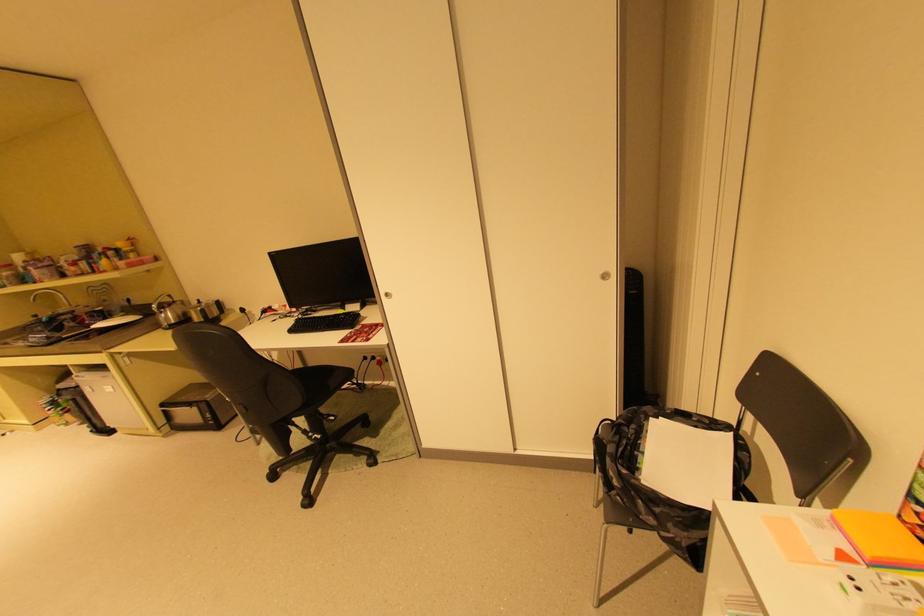
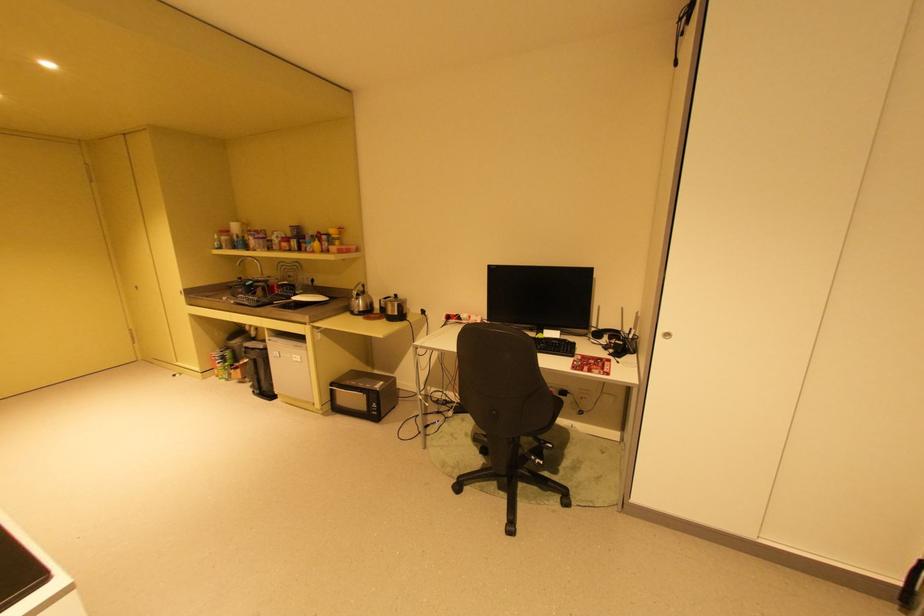
Locate, in the second image, the point that corresponds to point (160, 305) in the first image.

(359, 290)